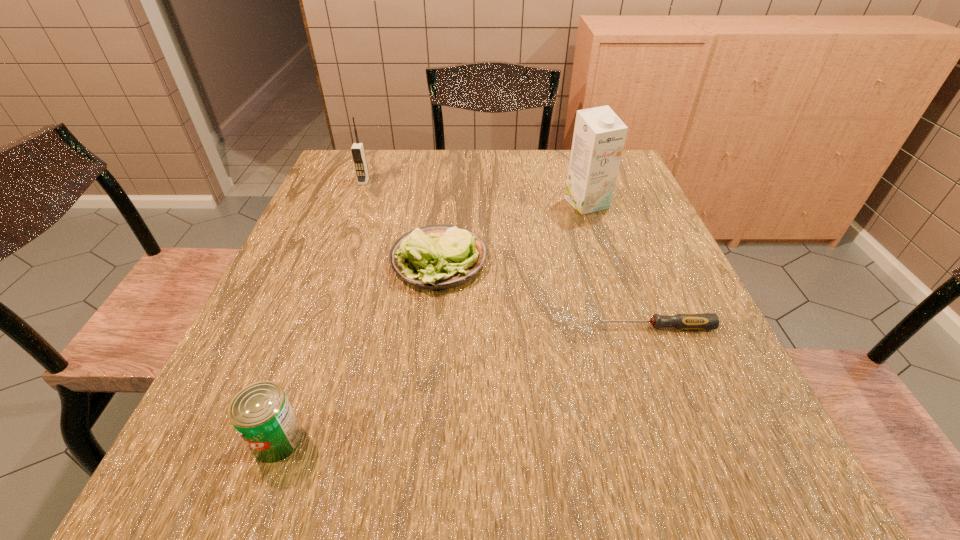
Where is `vacant space located 0.050m on the front of the carton`? The image size is (960, 540). vacant space located 0.050m on the front of the carton is located at coordinates (594, 227).

The image size is (960, 540). What are the coordinates of `free space located on the front-facing side of the farthest object` in the screenshot? It's located at (338, 248).

This screenshot has width=960, height=540. Identify the location of vacant area located 0.130m on the back of the nearest object. (309, 352).

Locate an element on the screen. vacant area situated on the back of the lettuce is located at coordinates tap(444, 208).

I want to click on free location located insert the fourth farthest object into a screw head, so click(451, 327).

At what (x,y) coordinates should I click in order to perform the action: click on vacant space situated insert the fourth farthest object into a screw head. Please return your answer as a coordinate pair (x, y). The height and width of the screenshot is (540, 960). Looking at the image, I should click on (519, 327).

The image size is (960, 540). Identify the location of free space located insert the fourth farthest object into a screw head. (456, 327).

Where is `object positioned at the far edge`? object positioned at the far edge is located at coordinates (357, 150).

Where is `object located at the near edge`? This screenshot has width=960, height=540. object located at the near edge is located at coordinates (261, 413).

Locate an element on the screen. The height and width of the screenshot is (540, 960). cellular telephone located in the left edge section of the desktop is located at coordinates (357, 150).